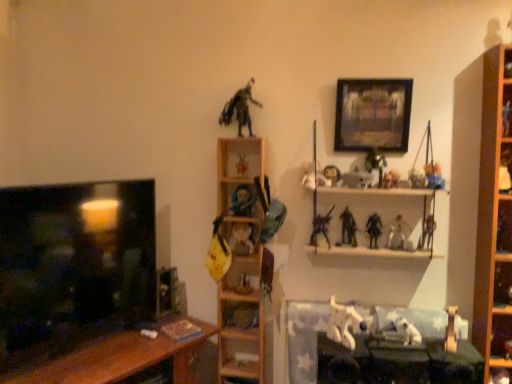
Question: Is metallic silver sword at center, which is the 13th toy from left to right, in front of wooden shelf at center, arranged as the 1th shelf when viewed from the left?

Choices:
 (A) no
 (B) yes

Answer: (B)

Question: From a real-world perspective, is metallic silver sword at center, which is the 13th toy from left to right, on wooden shelf at center, arranged as the 1th shelf when viewed from the left?

Choices:
 (A) no
 (B) yes

Answer: (B)

Question: Is wooden shelf at center, arranged as the 1th shelf when viewed from the left, inside metallic silver sword at center, which is the 5th toy from right to left?

Choices:
 (A) yes
 (B) no

Answer: (B)

Question: Is metallic silver sword at center, which is the 5th toy from right to left, smaller than wooden shelf at center, arranged as the 1th shelf when viewed from the left?

Choices:
 (A) no
 (B) yes

Answer: (B)

Question: Can you confirm if metallic silver sword at center, which is the 13th toy from left to right, is thinner than wooden shelf at center, marked as the 4th shelf in a right-to-left arrangement?

Choices:
 (A) no
 (B) yes

Answer: (B)

Question: Based on their positions, is brown wooden table at lower left, which is counted as the 2th table, starting from the right, located to the left or right of wooden table at lower center, the first table in the right-to-left sequence?

Choices:
 (A) left
 (B) right

Answer: (A)

Question: Is brown wooden table at lower left, the first table in the left-to-right sequence, bigger or smaller than wooden table at lower center, arranged as the 2th table when viewed from the left?

Choices:
 (A) small
 (B) big

Answer: (B)

Question: Considering the positions of brown wooden table at lower left, the first table in the left-to-right sequence, and wooden table at lower center, the first table in the right-to-left sequence, in the image, is brown wooden table at lower left, the first table in the left-to-right sequence, taller or shorter than wooden table at lower center, the first table in the right-to-left sequence,?

Choices:
 (A) tall
 (B) short

Answer: (A)

Question: Is brown wooden table at lower left, which is counted as the 2th table, starting from the right, spatially inside wooden table at lower center, arranged as the 2th table when viewed from the left, or outside of it?

Choices:
 (A) outside
 (B) inside

Answer: (A)

Question: Is wooden shelf at upper center, which ranks as the 2th shelf in right-to-left order, taller or shorter than white matte dog at lower center?

Choices:
 (A) short
 (B) tall

Answer: (B)

Question: From the image's perspective, relative to white matte dog at lower center, is wooden shelf at upper center, positioned as the third shelf in left-to-right order, above or below?

Choices:
 (A) above
 (B) below

Answer: (A)

Question: Looking at the image, does wooden shelf at upper center, which ranks as the 2th shelf in right-to-left order, seem bigger or smaller compared to white matte dog at lower center?

Choices:
 (A) big
 (B) small

Answer: (A)

Question: Is point (x=356, y=253) closer or farther from the camera than point (x=340, y=342)?

Choices:
 (A) farther
 (B) closer

Answer: (A)

Question: Is matte plastic action figure at center, which is the 10th toy in right-to-left order, taller or shorter than wooden shelf at right, arranged as the 1th shelf when viewed from the right?

Choices:
 (A) short
 (B) tall

Answer: (A)

Question: Considering the positions of matte plastic action figure at center, placed as the eighth toy when sorted from left to right, and wooden shelf at right, arranged as the 1th shelf when viewed from the right, in the image, is matte plastic action figure at center, placed as the eighth toy when sorted from left to right, bigger or smaller than wooden shelf at right, arranged as the 1th shelf when viewed from the right,?

Choices:
 (A) big
 (B) small

Answer: (B)